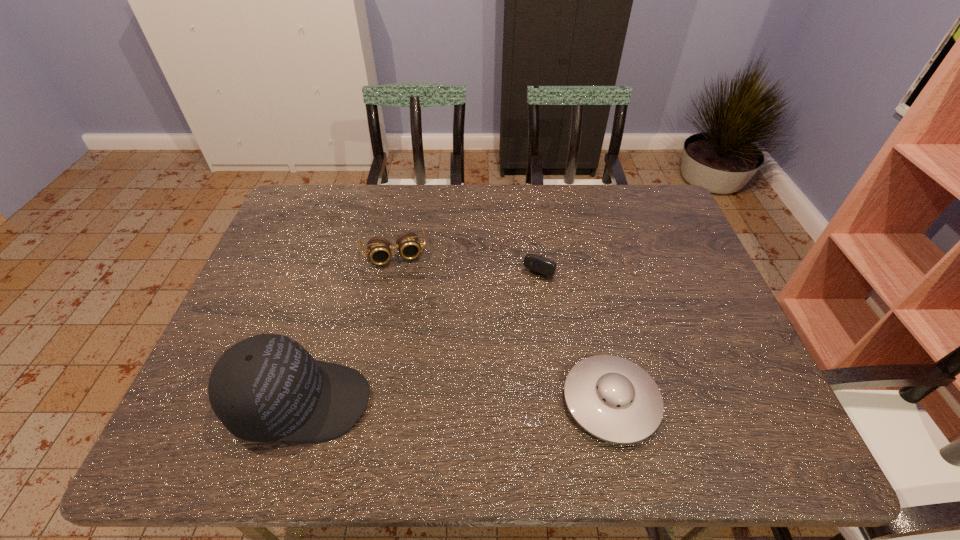
Identify the location of baseball cap. (266, 388).

Where is `saucer`? saucer is located at coordinates (615, 400).

This screenshot has width=960, height=540. In order to click on goggles in this screenshot , I will do `click(408, 245)`.

This screenshot has width=960, height=540. I want to click on webcam, so (539, 264).

In order to click on vacant space located at the front of the tallest object where the brim is located in this screenshot , I will do `click(485, 402)`.

Locate an element on the screen. free space located 0.220m on the left of the saucer is located at coordinates (462, 401).

What are the coordinates of `free location located through the lenses of the goggles` in the screenshot? It's located at (423, 384).

Find the location of a particular element. The image size is (960, 540). free space located through the lenses of the goggles is located at coordinates [x=407, y=308].

Identify the location of vacant space located through the lenses of the goggles. pos(417,352).

At what (x,y) coordinates should I click in order to perform the action: click on vacant space situated 0.130m on the front-facing side of the webcam. Please return your answer as a coordinate pair (x, y). The image size is (960, 540). Looking at the image, I should click on [520, 310].